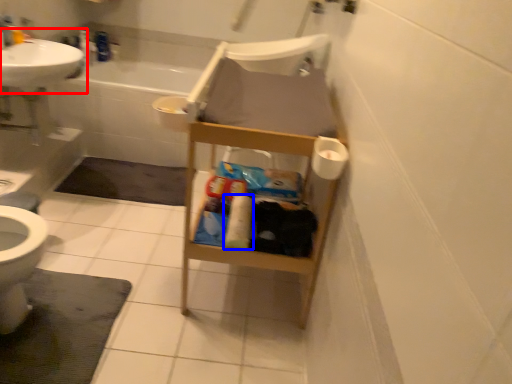
Question: Among these objects, which one is nearest to the camera, sink (highlighted by a red box) or toilet paper (highlighted by a blue box)?

Choices:
 (A) sink
 (B) toilet paper

Answer: (B)